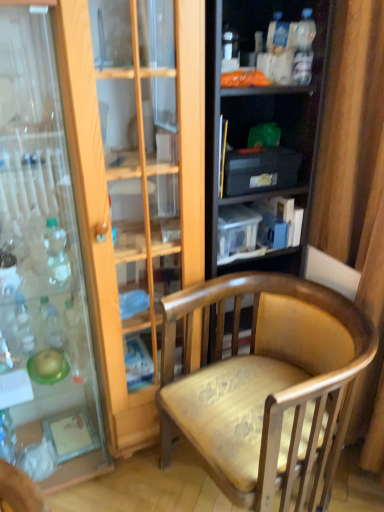
Question: Is black plastic storage at upper center, the 2th shelf from the top, in front of or behind clear glass bottle at left, the 1th bottle viewed from the top, in the image?

Choices:
 (A) behind
 (B) front

Answer: (A)

Question: From the image's perspective, is black plastic storage at upper center, which ranks as the first shelf in bottom-to-top order, above or below clear glass bottle at left, which is the 1th bottle from right to left?

Choices:
 (A) below
 (B) above

Answer: (B)

Question: Which of these objects is positioned farthest from the black plastic storage at upper center, the 2th shelf from the top?

Choices:
 (A) translucent plastic bottle at left, which appears as the first bottle when ordered from the bottom
 (B) clear glass bottle at left, acting as the 1th bottle starting from the front
 (C) translucent plastic bottles at upper right, arranged as the 2th shelf when ordered from the bottom
 (D) wooden armchair at center

Answer: (A)

Question: Considering the real-world distances, which object is closest to the translucent plastic bottle at left, which appears as the 1th bottle when viewed from the back?

Choices:
 (A) wooden armchair at center
 (B) clear glass bottle at left, acting as the 1th bottle starting from the front
 (C) translucent plastic bottles at upper right, acting as the first shelf starting from the top
 (D) black plastic storage at upper center, the 2th shelf from the top

Answer: (B)